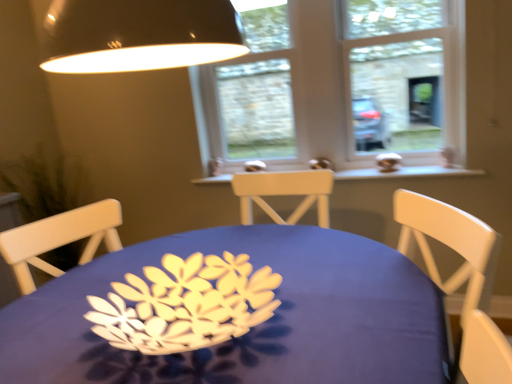
Question: Would you say white wood window sill at center is part of clear glass window at center's contents?

Choices:
 (A) no
 (B) yes

Answer: (A)

Question: Considering the relative sizes of clear glass window at center and white wood window sill at center in the image provided, is clear glass window at center bigger than white wood window sill at center?

Choices:
 (A) yes
 (B) no

Answer: (A)

Question: Does clear glass window at center appear on the left side of white wood window sill at center?

Choices:
 (A) no
 (B) yes

Answer: (B)

Question: From the image's perspective, is clear glass window at center beneath white wood window sill at center?

Choices:
 (A) yes
 (B) no

Answer: (B)

Question: Is clear glass window at center further to camera compared to white wood window sill at center?

Choices:
 (A) no
 (B) yes

Answer: (B)

Question: Is white plastic window frame at upper right wider or thinner than white wood window sill at center?

Choices:
 (A) thin
 (B) wide

Answer: (A)

Question: Is white plastic window frame at upper right inside or outside of white wood window sill at center?

Choices:
 (A) inside
 (B) outside

Answer: (B)

Question: From a real-world perspective, is white plastic window frame at upper right positioned above or below white wood window sill at center?

Choices:
 (A) below
 (B) above

Answer: (B)

Question: Is point (370, 114) positioned closer to the camera than point (452, 173)?

Choices:
 (A) closer
 (B) farther

Answer: (B)

Question: In terms of width, does clear glass window at center look wider or thinner when compared to blue fabric table at center?

Choices:
 (A) thin
 (B) wide

Answer: (A)

Question: Based on their positions, is clear glass window at center located to the left or right of blue fabric table at center?

Choices:
 (A) left
 (B) right

Answer: (B)

Question: Is clear glass window at center spatially inside blue fabric table at center, or outside of it?

Choices:
 (A) inside
 (B) outside

Answer: (B)

Question: Does point (223, 119) appear closer or farther from the camera than point (291, 326)?

Choices:
 (A) farther
 (B) closer

Answer: (A)

Question: In terms of width, does green matte plant at left look wider or thinner when compared to white wood window sill at center?

Choices:
 (A) thin
 (B) wide

Answer: (B)

Question: Is green matte plant at left bigger or smaller than white wood window sill at center?

Choices:
 (A) big
 (B) small

Answer: (A)